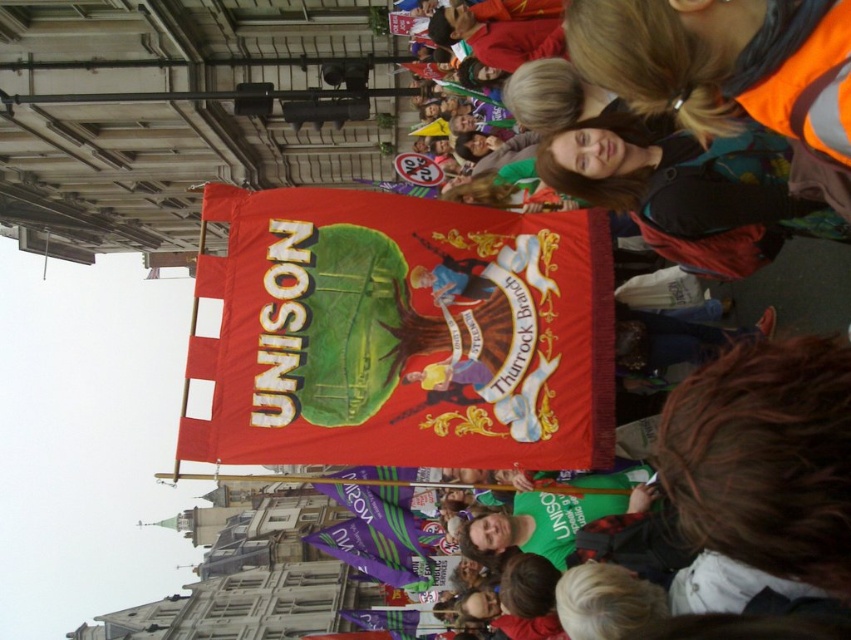
Does red fabric banner at center appear on the left side of purple fabric flag at lower center?

In fact, red fabric banner at center is to the right of purple fabric flag at lower center.

Does red fabric banner at center have a larger size compared to purple fabric flag at lower center?

Incorrect, red fabric banner at center is not larger than purple fabric flag at lower center.

Is point (338, 272) less distant than point (353, 545)?

That is True.

This screenshot has height=640, width=851. What are the coordinates of `red fabric banner at center` in the screenshot? It's located at (403, 333).

Can you confirm if purple fabric flag at lower center is positioned below purple fabric banner at center?

No, purple fabric flag at lower center is not below purple fabric banner at center.

Image resolution: width=851 pixels, height=640 pixels. I want to click on purple fabric flag at lower center, so click(372, 554).

Does point (350, 397) come behind point (367, 609)?

No, it is in front of (367, 609).

Between red fabric banner at center and purple fabric banner at center, which one is positioned higher?

red fabric banner at center is above.

Between point (221, 198) and point (387, 621), which one is positioned behind?

Point (387, 621)

This screenshot has height=640, width=851. I want to click on red fabric banner at center, so click(x=403, y=333).